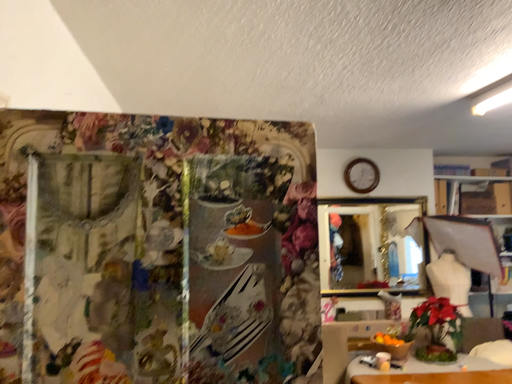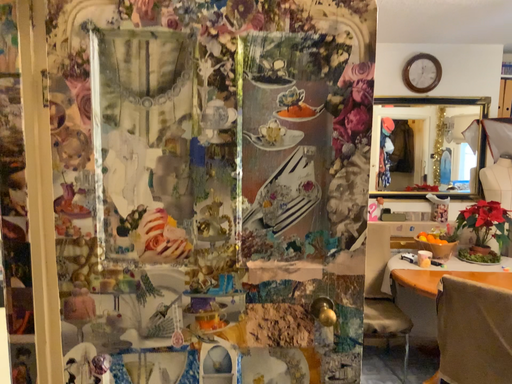
Question: Which way did the camera rotate in the video?

Choices:
 (A) rotated downward
 (B) rotated upward

Answer: (A)